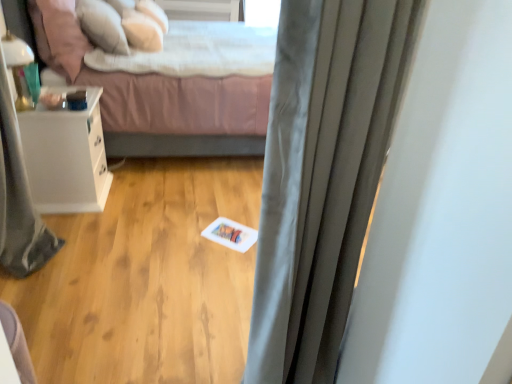
Question: In the image, is white glossy nightstand at left on the left side or the right side of white matte card at center?

Choices:
 (A) left
 (B) right

Answer: (A)

Question: Does point (100, 134) appear closer or farther from the camera than point (251, 238)?

Choices:
 (A) closer
 (B) farther

Answer: (B)

Question: Estimate the real-world distances between objects in this image. Which object is closer to the satin gray curtain at center?

Choices:
 (A) soft white pillow at upper center, marked as the 1th pillow in a back-to-front arrangement
 (B) white glossy nightstand at left
 (C) soft pink pillow at upper left, the 3th pillow when ordered from back to front
 (D) soft pink fabric bed at center
 (E) gray fabric shower curtain at left

Answer: (E)

Question: Which object is positioned closest to the soft white pillow at upper center, marked as the 1th pillow in a back-to-front arrangement?

Choices:
 (A) gray fabric shower curtain at left
 (B) soft pink pillow at upper left, the 3th pillow when ordered from back to front
 (C) white matte card at center
 (D) white glossy nightstand at left
 (E) satin gray curtain at center

Answer: (B)